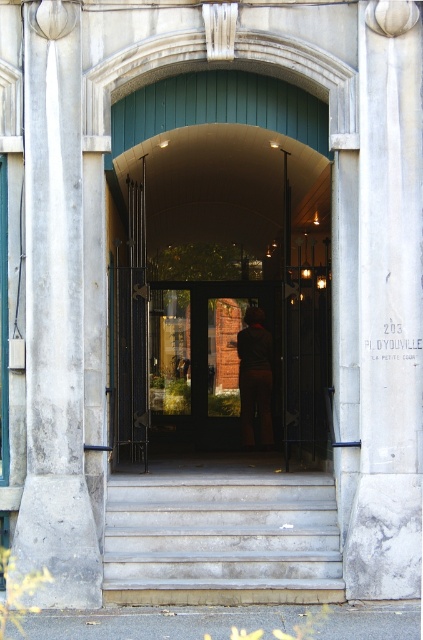
Question: Which point is farther to the camera?

Choices:
 (A) smooth stone pillar at left
 (B) smooth concrete stairs at center
 (C) matte glass door at center

Answer: (C)

Question: Considering the relative positions of white marble pillar at right and smooth stone pillar at left in the image provided, where is white marble pillar at right located with respect to smooth stone pillar at left?

Choices:
 (A) below
 (B) above

Answer: (B)

Question: Can you confirm if white marble pillar at right is thinner than smooth concrete stairs at center?

Choices:
 (A) no
 (B) yes

Answer: (B)

Question: Estimate the real-world distances between objects in this image. Which object is farther from the brown leather jacket at center?

Choices:
 (A) matte glass door at center
 (B) smooth concrete stairs at center

Answer: (B)

Question: Is white marble pillar at right wider than smooth stone pillar at left?

Choices:
 (A) no
 (B) yes

Answer: (A)

Question: Which point is farther to the camera?

Choices:
 (A) (376, 93)
 (B) (79, 467)

Answer: (A)